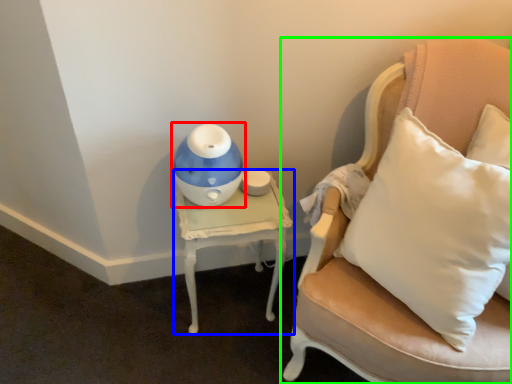
Question: Which object is the farthest from toy (highlighted by a red box)? Choose among these: table (highlighted by a blue box) or chair (highlighted by a green box).

Choices:
 (A) table
 (B) chair

Answer: (B)